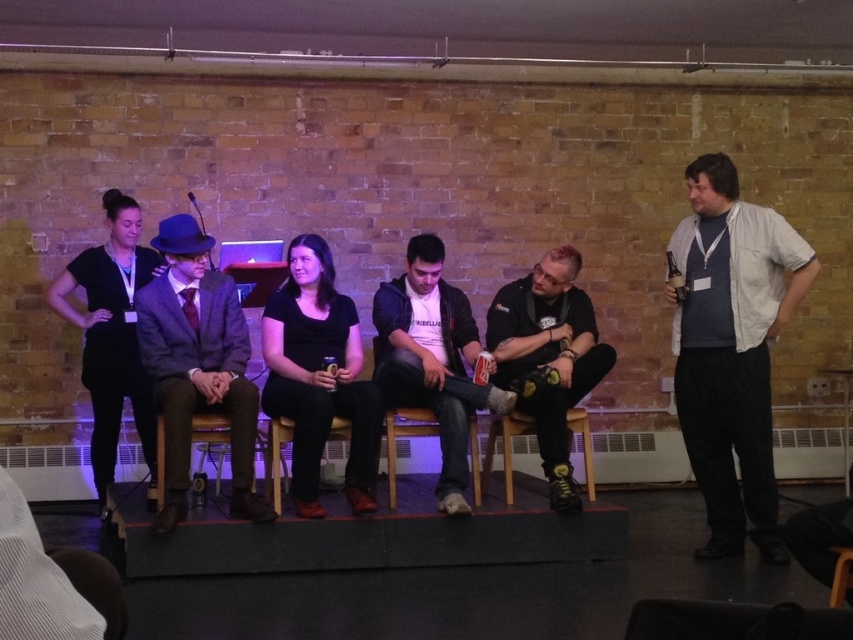
Question: Which point is closer to the camera taking this photo?

Choices:
 (A) (448, 328)
 (B) (570, 404)
 (C) (131, 248)

Answer: (B)

Question: Which of the following is the closest to the observer?

Choices:
 (A) (209, 420)
 (B) (437, 504)
 (C) (109, 296)

Answer: (A)

Question: Is white cotton shirt at right below black matte shirt at center?

Choices:
 (A) yes
 (B) no

Answer: (B)

Question: Which of the following is the closest to the observer?

Choices:
 (A) (514, 294)
 (B) (834, 605)
 (C) (109, 262)
 (D) (160, 346)

Answer: (B)

Question: Does white cotton shirt at right have a smaller size compared to black fabric dress at left?

Choices:
 (A) yes
 (B) no

Answer: (A)

Question: Does white cotton shirt at right appear on the right side of brown wooden chair at center?

Choices:
 (A) no
 (B) yes

Answer: (B)